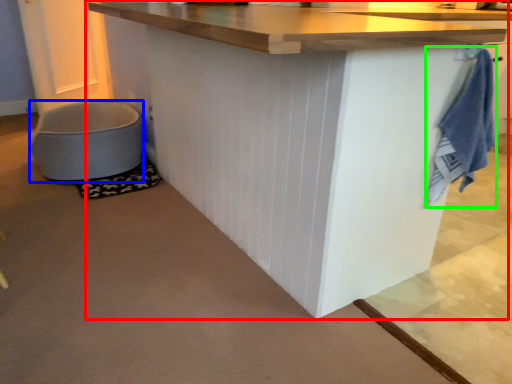
Question: Based on their relative distances, which object is farther from table (highlighted by a red box)? Choose from toilet bowl (highlighted by a blue box) and bath towel (highlighted by a green box).

Choices:
 (A) toilet bowl
 (B) bath towel

Answer: (A)